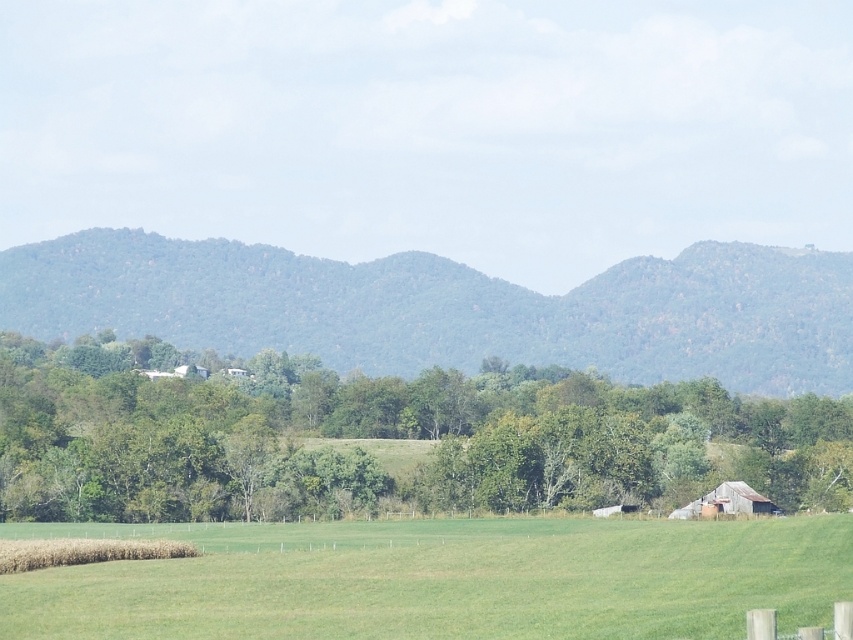
You are a GUI agent. You are given a task and a screenshot of the screen. Output one action in this format:
    pyautogui.click(x=<x>, y=<y>)
    Task: Click on the green leafy tree at center
    Image resolution: width=853 pixels, height=640 pixels.
    Given the screenshot: What is the action you would take?
    pyautogui.click(x=381, y=436)

Who is higher up, green leafy tree at center or green grassy field at lower center?

green grassy field at lower center is above.

At what (x,y) coordinates should I click in order to perform the action: click on green leafy tree at center. Please return your answer as a coordinate pair (x, y). Looking at the image, I should click on (381, 436).

How distant is green leafy tree at center from green leafy forest at center?

green leafy tree at center is 310.56 feet away from green leafy forest at center.

Is point (273, 486) positioned after point (257, 298)?

No, it is not.

At what (x,y) coordinates should I click in order to perform the action: click on green leafy tree at center. Please return your answer as a coordinate pair (x, y). The width and height of the screenshot is (853, 640). Looking at the image, I should click on (381, 436).

Who is shorter, green leafy forest at center or green grassy field at lower center?

With less height is green grassy field at lower center.

Consider the image. Is green leafy forest at center positioned before green grassy field at lower center?

No, it is not.

You are a GUI agent. You are given a task and a screenshot of the screen. Output one action in this format:
    pyautogui.click(x=<x>, y=<y>)
    Task: Click on the green leafy forest at center
    
    Given the screenshot: What is the action you would take?
    pyautogui.click(x=451, y=308)

Identify the location of green leafy forest at center. The width and height of the screenshot is (853, 640). click(x=451, y=308).